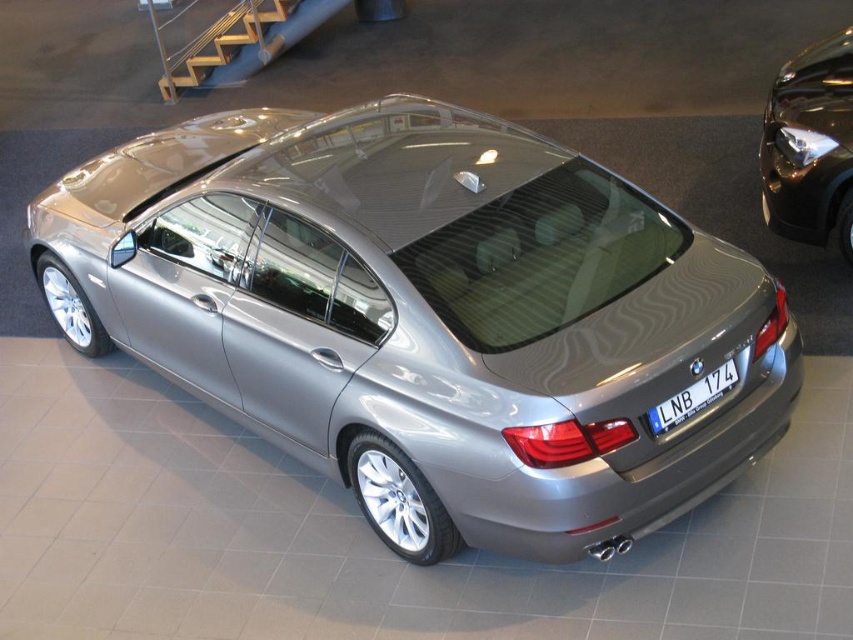
Question: Which of these objects is positioned closest to the satin metallic car at center?

Choices:
 (A) blue metallic license plate at rear
 (B) glossy black car at upper right

Answer: (A)

Question: Which object appears farthest from the camera in this image?

Choices:
 (A) blue metallic license plate at rear
 (B) satin metallic car at center

Answer: (A)

Question: Does satin metallic car at center have a greater width compared to glossy black car at upper right?

Choices:
 (A) yes
 (B) no

Answer: (A)

Question: Does satin metallic car at center have a larger size compared to glossy black car at upper right?

Choices:
 (A) yes
 (B) no

Answer: (A)

Question: Where is satin metallic car at center located in relation to glossy black car at upper right in the image?

Choices:
 (A) above
 (B) below

Answer: (B)

Question: Among these points, which one is farthest from the camera?

Choices:
 (A) (839, 218)
 (B) (663, 404)
 (C) (462, 268)

Answer: (A)